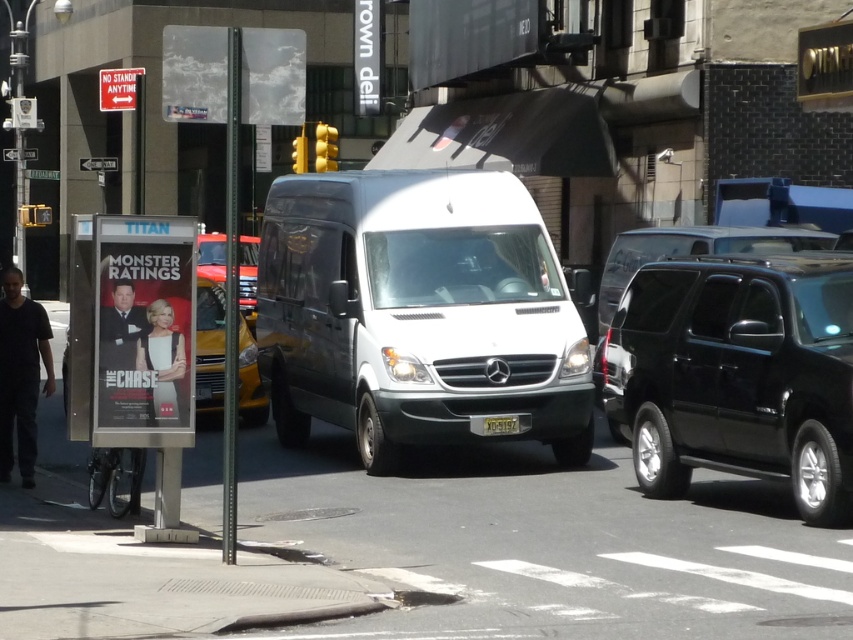
Question: Does white glossy van at center have a smaller size compared to yellow metallic taxi cab at left?

Choices:
 (A) no
 (B) yes

Answer: (B)

Question: Which of the following is the closest to the observer?

Choices:
 (A) (312, 221)
 (B) (724, 314)

Answer: (B)

Question: Estimate the real-world distances between objects in this image. Which object is farther from the yellow matte license plate at center?

Choices:
 (A) black metallic suv at right
 (B) metallic silver van at center
 (C) yellow metallic taxi cab at left
 (D) black glossy suv at center right

Answer: (B)

Question: In this image, where is yellow metallic taxi cab at left located relative to yellow matte license plate at center?

Choices:
 (A) above
 (B) below

Answer: (A)

Question: Does black metallic suv at right have a lesser width compared to black glossy suv at center right?

Choices:
 (A) no
 (B) yes

Answer: (B)

Question: Based on their relative distances, which object is nearer to the metallic silver van at center?

Choices:
 (A) black metallic suv at right
 (B) white glossy van at center
 (C) yellow metallic taxi cab at left

Answer: (C)